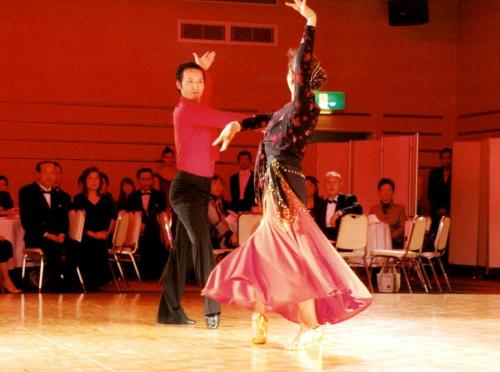
This screenshot has width=500, height=372. Identify the location of speaker. (411, 14).